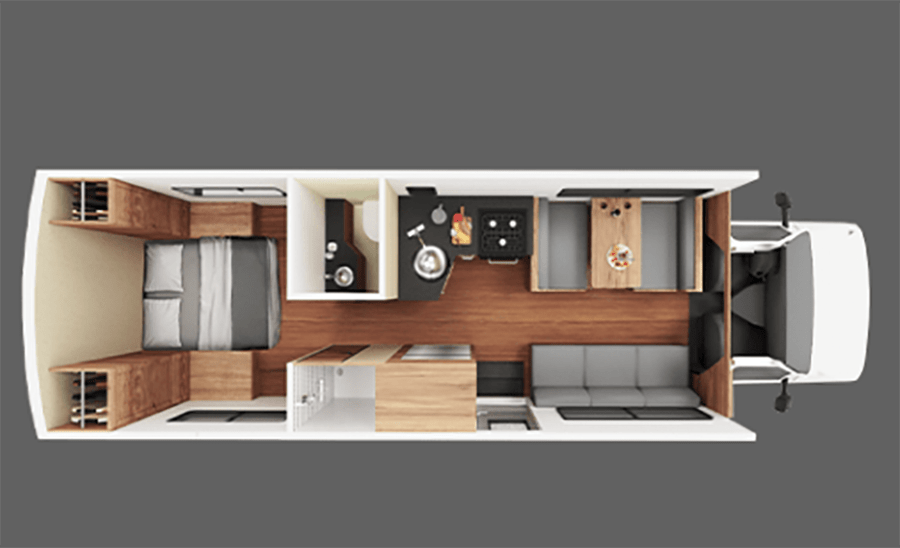
The width and height of the screenshot is (900, 548). Find the location of `toilet`. toilet is located at coordinates (363, 237).